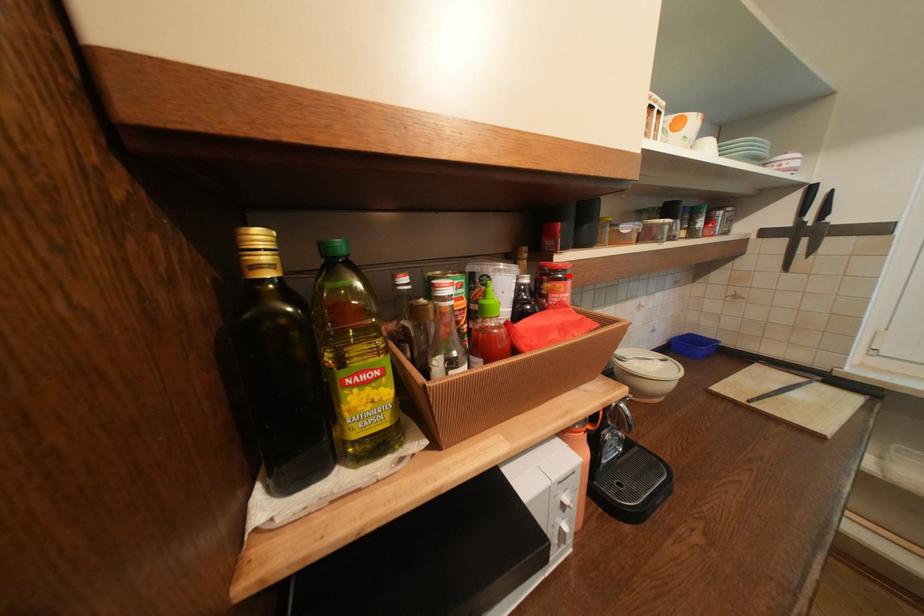
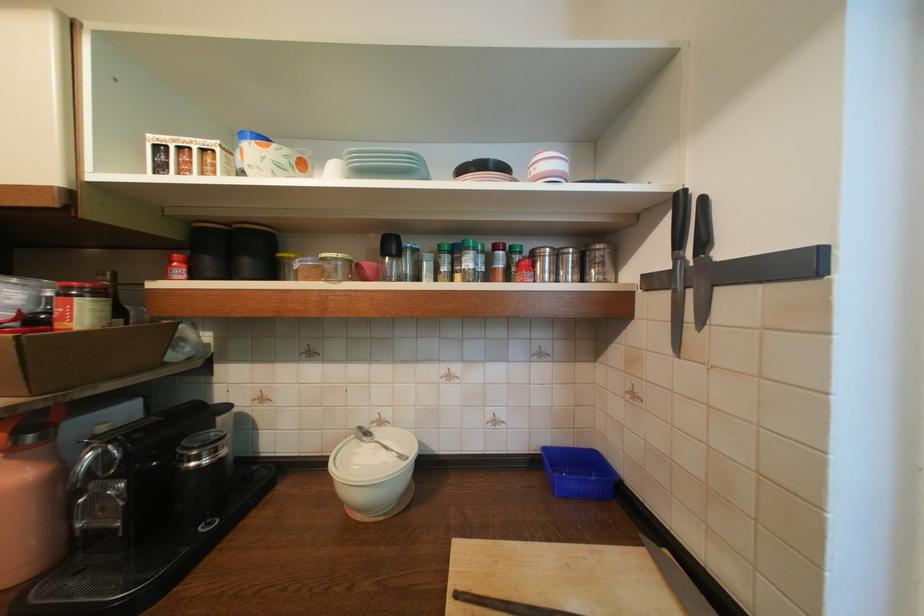
In the second image, find the point that corresponds to the highlighted location in the first image.

(82, 294)